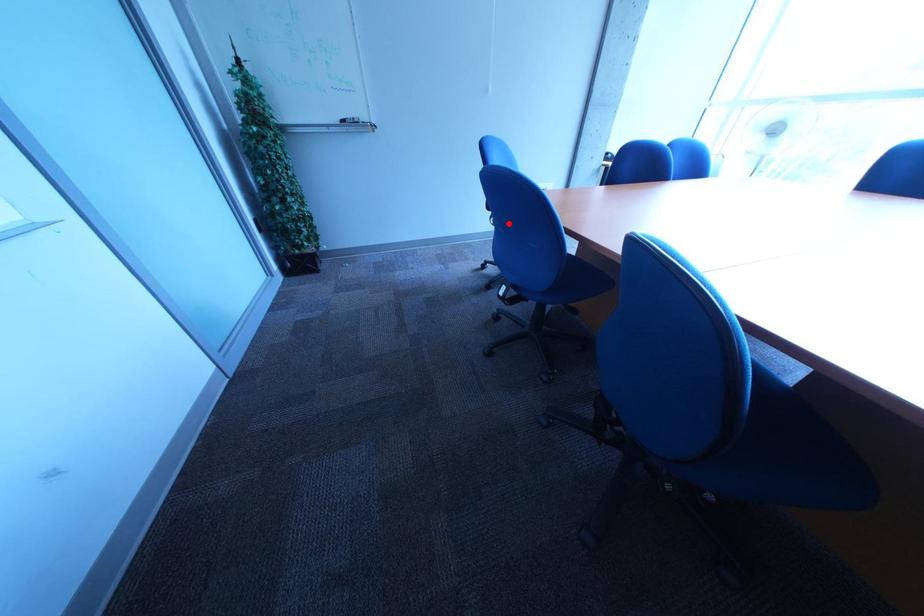
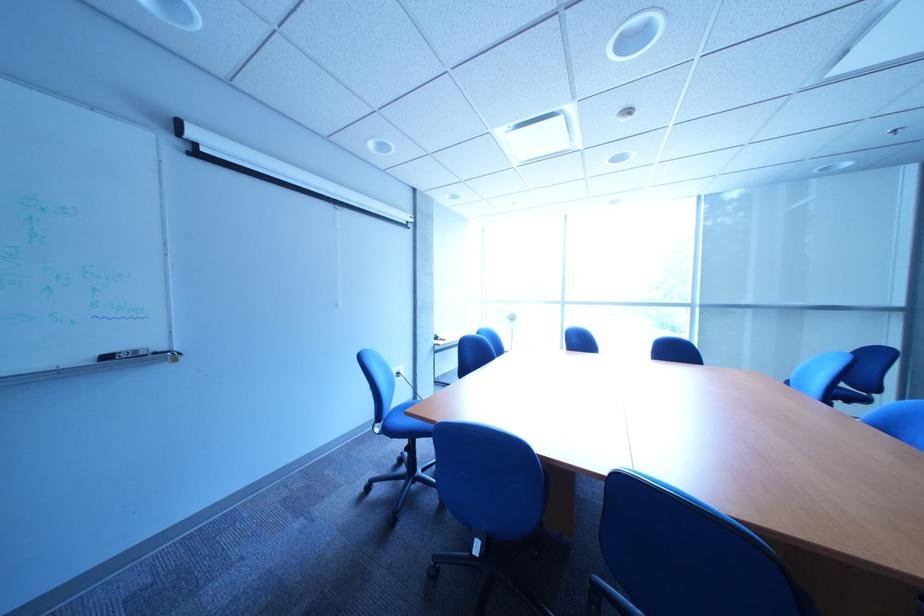
In the second image, find the point that corresponds to the highlighted location in the first image.

(392, 432)